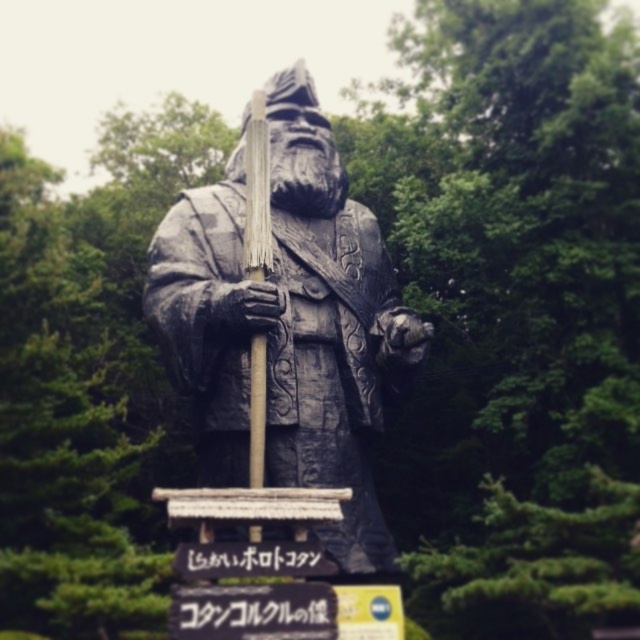
From the picture: You are an art student visiting the statue and need to sketch it. Your sketchbook can only accommodate items up to the height of the black plastic sign at center. Will the bronze statue at center fit in your sketchbook?

The bronze statue at center is taller than the black plastic sign at center, so it will not fit in your sketchbook which can only accommodate items up to the height of the black plastic sign at center.

You are a tour guide leading a group to the bronze statue at center. The group asks if the black plastic sign at center is bigger than the statue. How do you respond?

The bronze statue at center has a larger size compared to the black plastic sign at center, so the statue is bigger than the sign.

You are standing at the center of the image. Which direction should you move to get closer to the bronze statue at center?

Since the bronze statue at center is already at the center of the image, you are already facing it. There is no need to move in any direction to get closer.